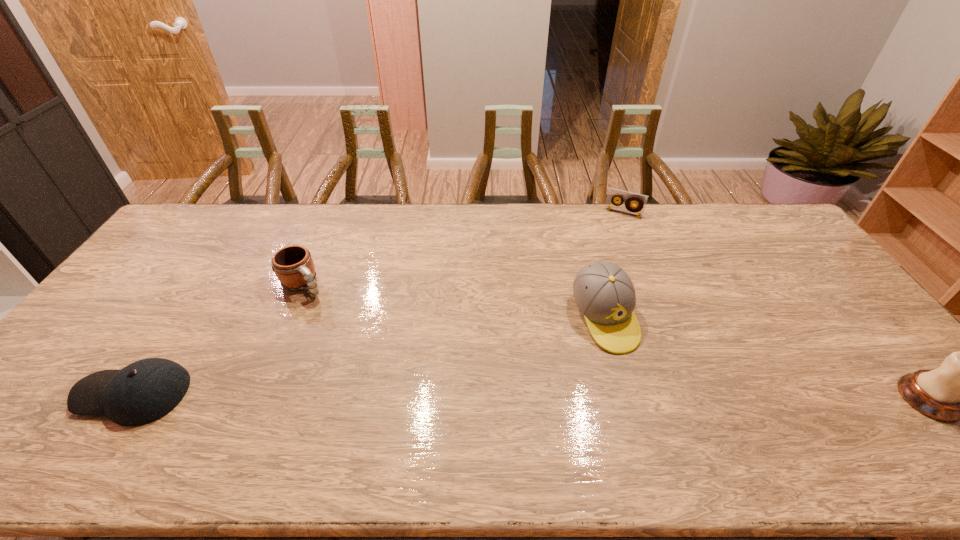
Find the location of a particular element. The height and width of the screenshot is (540, 960). vacant area between the nearer baseball cap and the second object from left to right is located at coordinates (218, 340).

The height and width of the screenshot is (540, 960). I want to click on object identified as the closest to the rightmost object, so click(604, 293).

Identify which object is the closest to the nearer baseball cap. Please provide its 2D coordinates. Your answer should be formatted as a tuple, i.e. [(x, y)], where the tuple contains the x and y coordinates of a point satisfying the conditions above.

[(293, 265)]

Find the location of a particular element. vacant region that satisfies the following two spatial constraints: 1. on the back side of the fourth object from left to right; 2. on the right side of the mug is located at coordinates (333, 213).